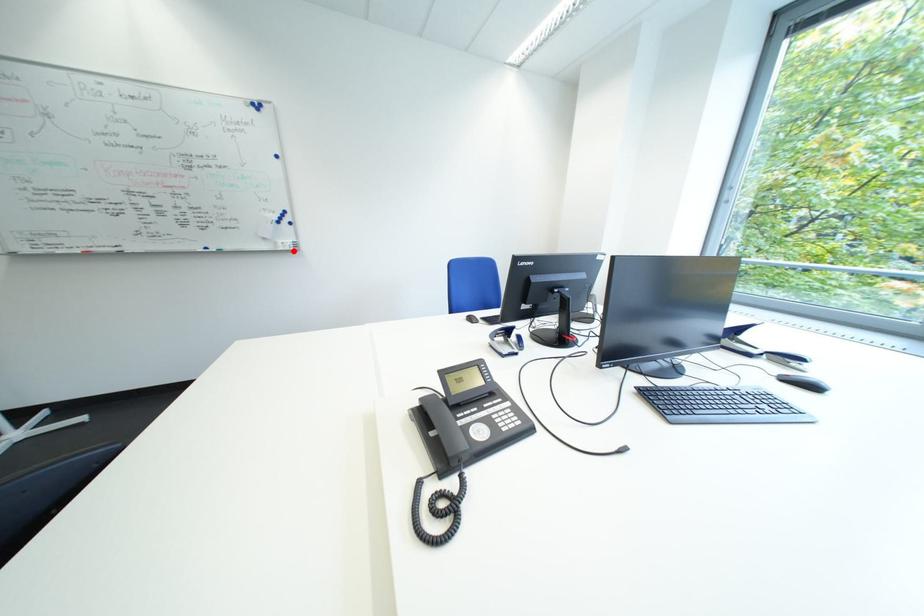
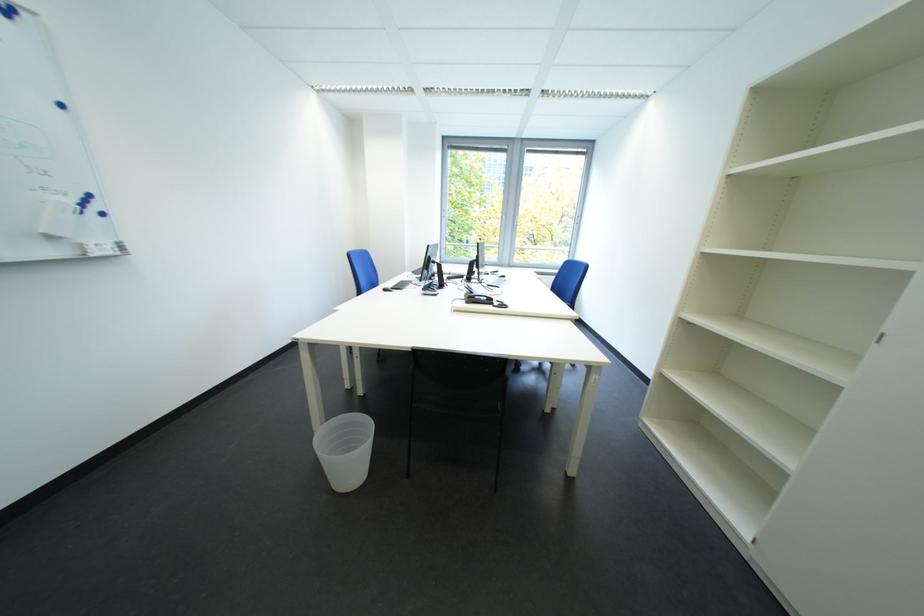
Find the pixel in the second image that matches the highlighted location in the first image.

(108, 256)